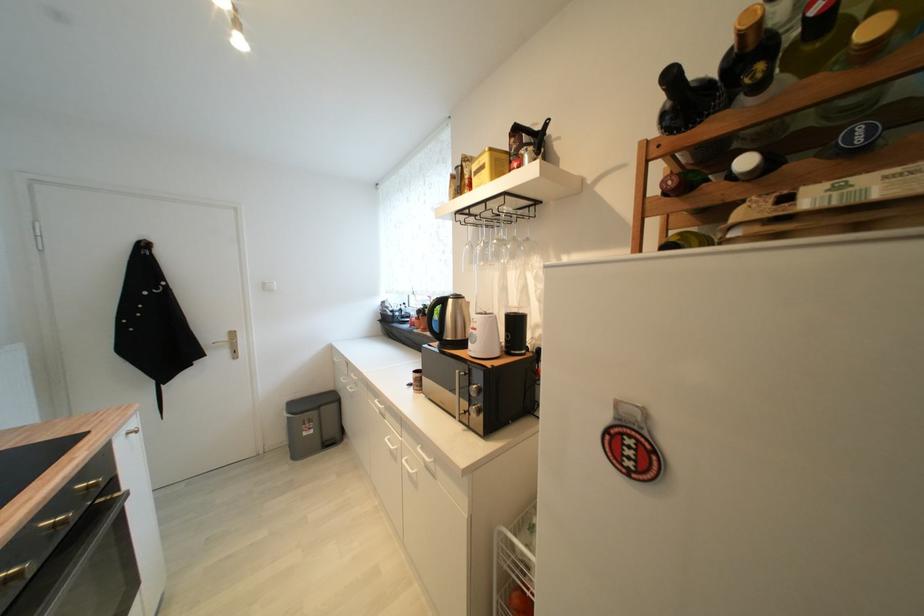
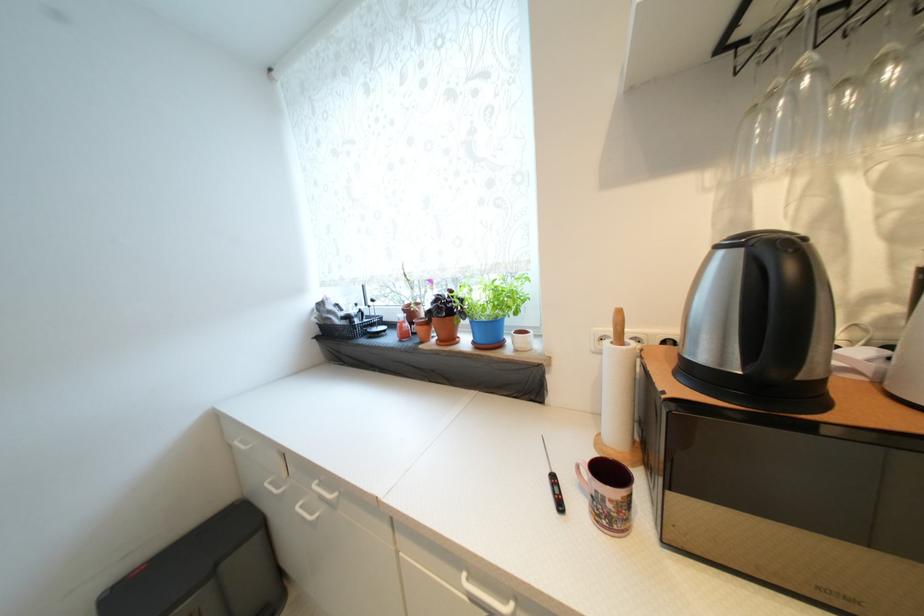
Locate, in the second image, the point that corresponds to (x=341, y=407) in the first image.

(261, 541)